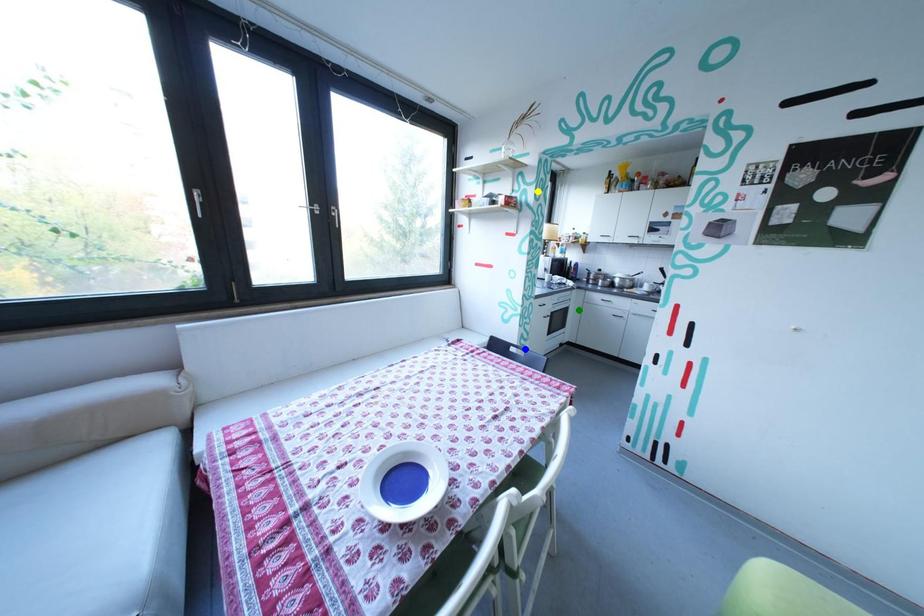
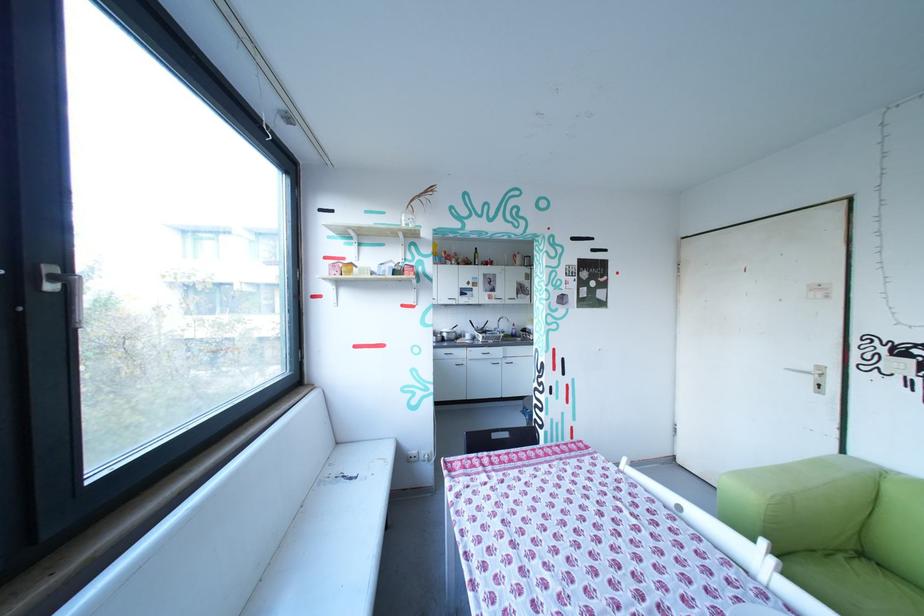
I am providing you with two images of the same scene from different viewpoints. Three points are marked in image1. Which point corresponds to a part or object that is occluded in image2?In image1, three points are marked. Which of them correspond to a part or object that is occluded in image2?Among the three points shown in image1, which one corresponds to a part or object that is no longer visible due to occlusion in image2?

green point cannot be seen in image2.